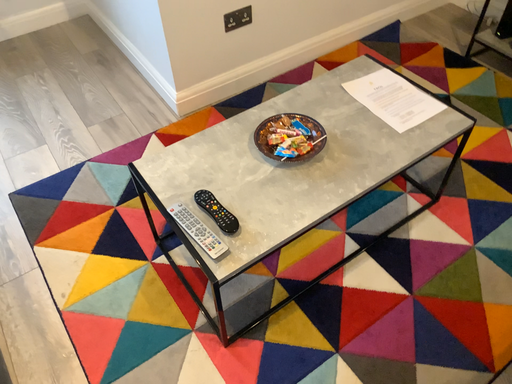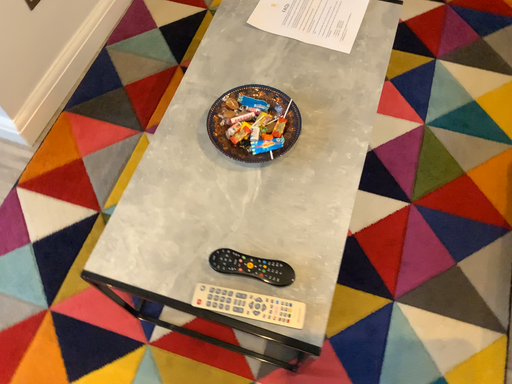
Question: How did the camera likely rotate when shooting the video?

Choices:
 (A) rotated left
 (B) rotated right

Answer: (B)